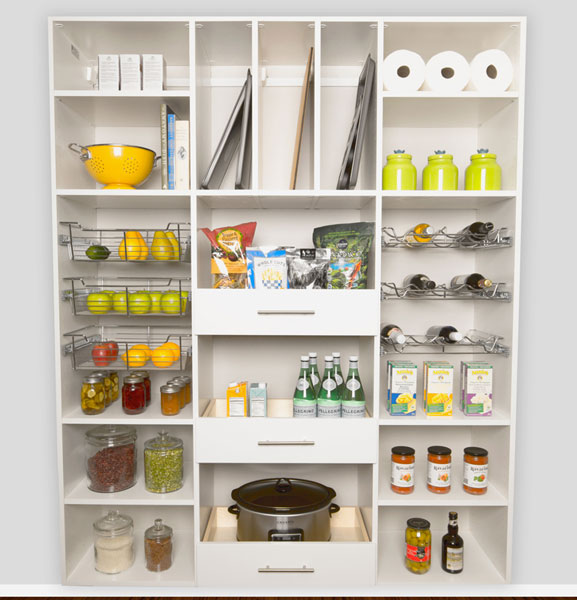
Identify the location of glass containers. (166, 471), (117, 463), (95, 397), (131, 394), (168, 403), (119, 556), (160, 553), (415, 553).